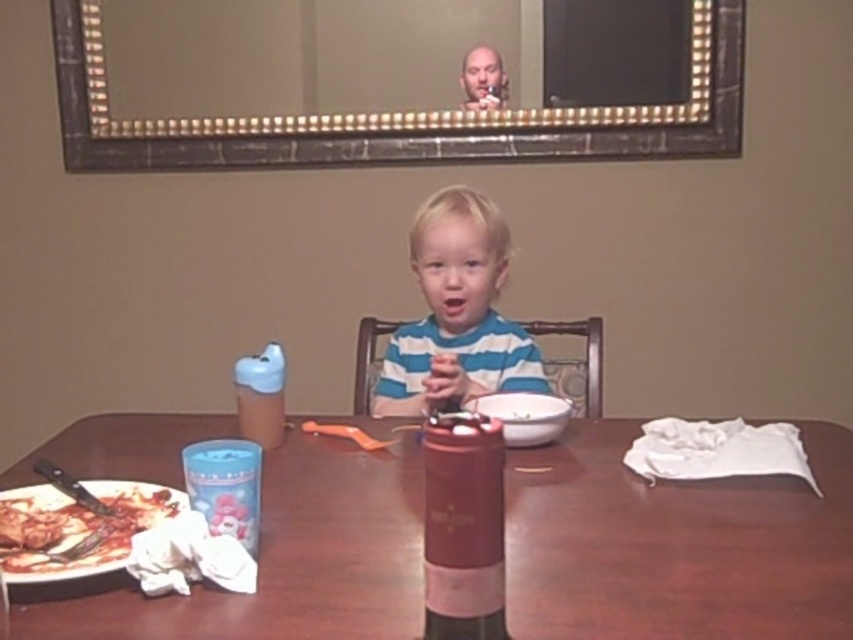
You are a photographer taking a picture of the wooden table at center and the blue striped shirt at center. Which object will appear larger in the photo?

The wooden table at center will appear larger in the photo because it is closer to the viewer than the blue striped shirt at center.

You are a parent trying to reach the wooden table at center from where you are standing. The shiny metallic pizza at lower left is blocking your path. Can you step over it?

The wooden table at center has a greater height compared to shiny metallic pizza at lower left, so yes, you can step over the shiny metallic pizza at lower left to reach the wooden table at center.